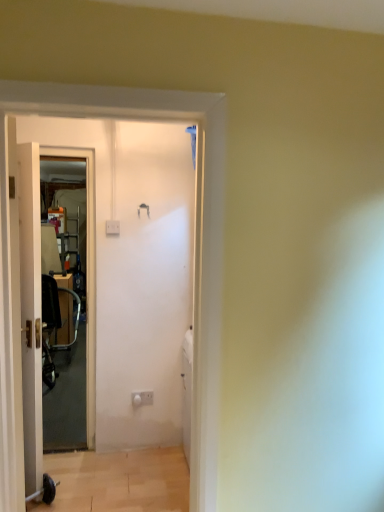
I want to click on white plastic electric outlet at center, so pos(142,398).

This screenshot has height=512, width=384. Describe the element at coordinates (31, 311) in the screenshot. I see `white wooden door at left` at that location.

You are a GUI agent. You are given a task and a screenshot of the screen. Output one action in this format:
    pyautogui.click(x=<x>, y=<y>)
    Task: Click on the metallic silver baby carriage at left
    Image resolution: width=384 pixels, height=512 pixels.
    Given the screenshot: What is the action you would take?
    pyautogui.click(x=54, y=326)

From the image's perspective, which object appears higher, white plastic electric outlet at center or wooden frame screen door at left?

From the image's view, wooden frame screen door at left is above.

From a real-world perspective, is white plastic electric outlet at center on wooden frame screen door at left?

No.

Does white plastic electric outlet at center appear on the right side of wooden frame screen door at left?

Yes, white plastic electric outlet at center is to the right of wooden frame screen door at left.

Would you say white plastic electric outlet at center contains wooden frame screen door at left?

No, white plastic electric outlet at center does not contain wooden frame screen door at left.

Considering the sizes of objects white wooden door at left and wooden frame screen door at left in the image provided, who is taller, white wooden door at left or wooden frame screen door at left?

wooden frame screen door at left is taller.

Considering their positions, is white wooden door at left located in front of or behind wooden frame screen door at left?

white wooden door at left is positioned closer to the viewer than wooden frame screen door at left.

Does white wooden door at left have a lesser width compared to wooden frame screen door at left?

Indeed, white wooden door at left has a lesser width compared to wooden frame screen door at left.

In terms of height, does wooden frame screen door at left look taller or shorter compared to white plastic electric outlet at center?

Considering their sizes, wooden frame screen door at left has more height than white plastic electric outlet at center.

From the image's perspective, who appears lower, wooden frame screen door at left or white plastic electric outlet at center?

white plastic electric outlet at center.

At what (x,y) coordinates should I click in order to perform the action: click on electric outlet that is under the wooden frame screen door at left (from a real-world perspective). Please return your answer as a coordinate pair (x, y). Looking at the image, I should click on (142, 398).

From the picture: Does wooden frame screen door at left have a larger size compared to white wooden door at left?

Actually, wooden frame screen door at left might be smaller than white wooden door at left.

Can you confirm if wooden frame screen door at left is positioned to the left of white wooden door at left?

No, wooden frame screen door at left is not to the left of white wooden door at left.

Does wooden frame screen door at left have a greater width compared to white wooden door at left?

Yes.

The image size is (384, 512). Find the location of `door on the left of wooden frame screen door at left`. door on the left of wooden frame screen door at left is located at coordinates (31, 311).

Does metallic silver baby carriage at left have a lesser width compared to wooden frame screen door at left?

In fact, metallic silver baby carriage at left might be wider than wooden frame screen door at left.

From a real-world perspective, who is located lower, metallic silver baby carriage at left or wooden frame screen door at left?

metallic silver baby carriage at left is physically lower.

Can you tell me how much metallic silver baby carriage at left and wooden frame screen door at left differ in facing direction?

90.8 degrees separate the facing orientations of metallic silver baby carriage at left and wooden frame screen door at left.

Can you confirm if metallic silver baby carriage at left is smaller than wooden frame screen door at left?

No.

Is white plastic electric outlet at center to the right of metallic silver baby carriage at left from the viewer's perspective?

Yes, white plastic electric outlet at center is to the right of metallic silver baby carriage at left.

Is the position of white plastic electric outlet at center less distant than that of metallic silver baby carriage at left?

Yes, it is in front of metallic silver baby carriage at left.

From a real-world perspective, who is located higher, white plastic electric outlet at center or metallic silver baby carriage at left?

white plastic electric outlet at center, from a real-world perspective.

Considering the positions of point (132, 403) and point (44, 290), is point (132, 403) closer or farther from the camera than point (44, 290)?

Clearly, point (132, 403) is closer to the camera than point (44, 290).

Is white wooden door at left oriented away from metallic silver baby carriage at left?

No, white wooden door at left's orientation is not away from metallic silver baby carriage at left.

From the image's perspective, which is below, white wooden door at left or metallic silver baby carriage at left?

metallic silver baby carriage at left appears lower in the image.

Can you confirm if white wooden door at left is taller than metallic silver baby carriage at left?

Correct, white wooden door at left is much taller as metallic silver baby carriage at left.

How much distance is there between white wooden door at left and metallic silver baby carriage at left?

white wooden door at left is 2.61 meters away from metallic silver baby carriage at left.

Find the location of `electric outlet that appears below the wooden frame screen door at left (from a real-world perspective)`. electric outlet that appears below the wooden frame screen door at left (from a real-world perspective) is located at coordinates (142, 398).

Locate an element on the screen. The width and height of the screenshot is (384, 512). screen door on the right side of white wooden door at left is located at coordinates (87, 273).

When comparing their distances from wooden frame screen door at left, does metallic silver baby carriage at left or white plastic electric outlet at center seem further?

metallic silver baby carriage at left is positioned further to the anchor wooden frame screen door at left.

Based on their spatial positions, is wooden frame screen door at left or white wooden door at left further from white plastic electric outlet at center?

white wooden door at left lies further to white plastic electric outlet at center than the other object.

Which object lies nearer to the anchor point white plastic electric outlet at center, metallic silver baby carriage at left or white wooden door at left?

white wooden door at left is closer to white plastic electric outlet at center.

Estimate the real-world distances between objects in this image. Which object is closer to wooden frame screen door at left, metallic silver baby carriage at left or white wooden door at left?

white wooden door at left is closer to wooden frame screen door at left.

Based on their spatial positions, is wooden frame screen door at left or white wooden door at left closer to metallic silver baby carriage at left?

wooden frame screen door at left.

Considering their positions, is metallic silver baby carriage at left positioned further to white plastic electric outlet at center than wooden frame screen door at left?

metallic silver baby carriage at left is further to white plastic electric outlet at center.

Considering their positions, is white wooden door at left positioned closer to metallic silver baby carriage at left than wooden frame screen door at left?

wooden frame screen door at left is positioned closer to the anchor metallic silver baby carriage at left.

Based on their spatial positions, is white plastic electric outlet at center or white wooden door at left further from wooden frame screen door at left?

Among the two, white wooden door at left is located further to wooden frame screen door at left.

You are a GUI agent. You are given a task and a screenshot of the screen. Output one action in this format:
    pyautogui.click(x=<x>, y=<y>)
    Task: Click on the electric outlet between white wooden door at left and metallic silver baby carriage at left in the front-back direction
    This screenshot has width=384, height=512.
    Given the screenshot: What is the action you would take?
    pyautogui.click(x=142, y=398)

Where is `electric outlet between wooden frame screen door at left and metallic silver baby carriage at left from front to back`? The width and height of the screenshot is (384, 512). electric outlet between wooden frame screen door at left and metallic silver baby carriage at left from front to back is located at coordinates (142, 398).

You are a GUI agent. You are given a task and a screenshot of the screen. Output one action in this format:
    pyautogui.click(x=<x>, y=<y>)
    Task: Click on the screen door between white wooden door at left and metallic silver baby carriage at left along the z-axis
    This screenshot has width=384, height=512.
    Given the screenshot: What is the action you would take?
    pyautogui.click(x=87, y=273)

Identify the location of screen door between white wooden door at left and white plastic electric outlet at center along the z-axis. The height and width of the screenshot is (512, 384). (87, 273).